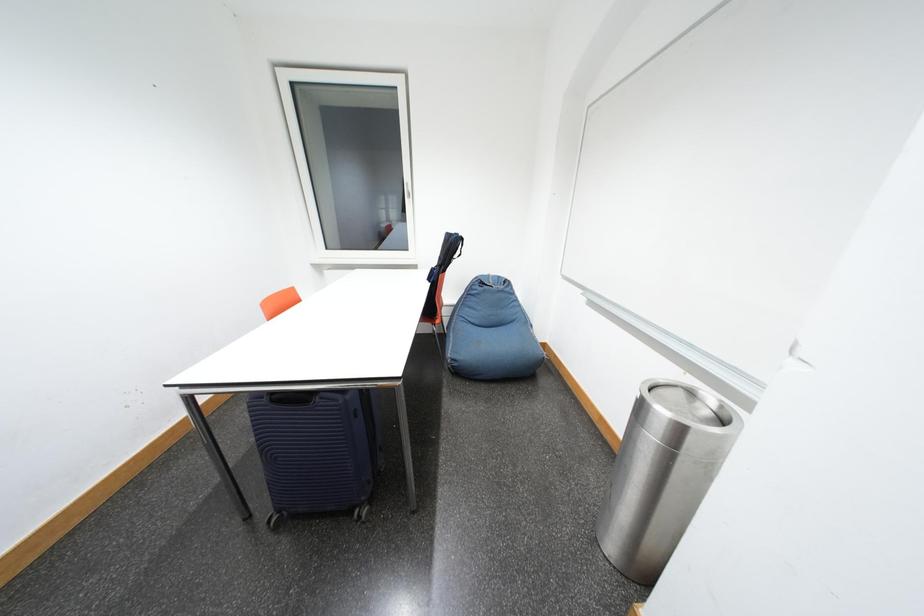
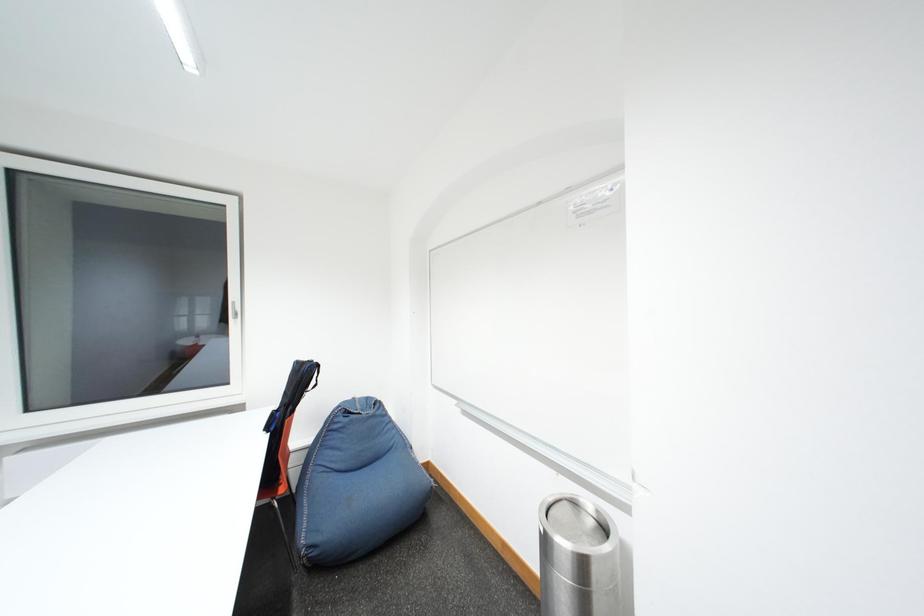
Based on the continuous images, in which direction is the camera rotating?

The camera's rotation is toward right-up.